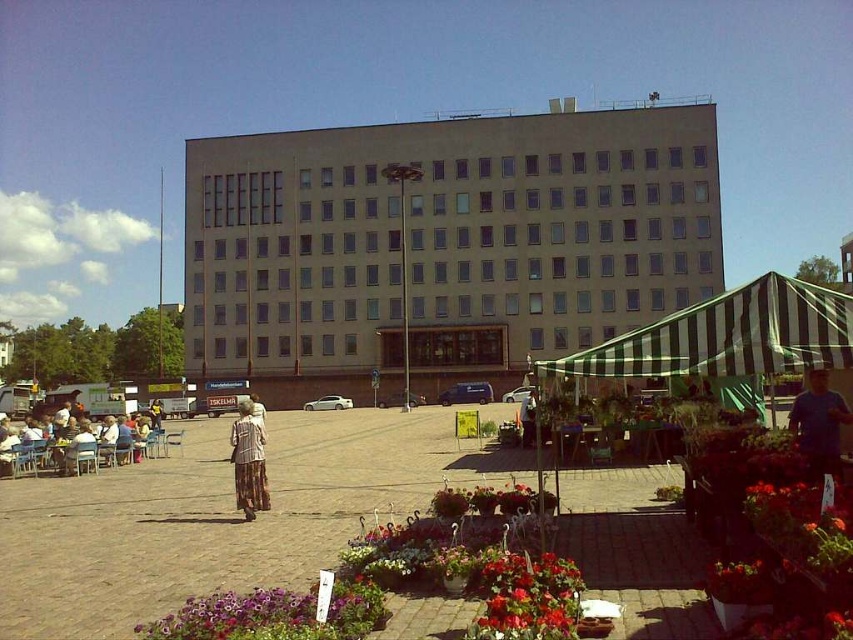
How much distance is there between purple matte flower at lower center and striped shirt at lower left?

purple matte flower at lower center is 14.54 meters away from striped shirt at lower left.

Is purple matte flower at lower center thinner than striped shirt at lower left?

Yes, purple matte flower at lower center is thinner than striped shirt at lower left.

Which is behind, point (134, 628) or point (128, 435)?

The point (128, 435) is more distant.

This screenshot has width=853, height=640. Identify the location of purple matte flower at lower center. (274, 614).

Consider the image. Is green striped canopy at right thinner than striped shirt at lower left?

In fact, green striped canopy at right might be wider than striped shirt at lower left.

Which is behind, point (796, 278) or point (91, 428)?

The point (796, 278) is more distant.

Who is more distant from viewer, (726,300) or (82,456)?

The point (82,456) is behind.

Where is `green striped canopy at right`? The height and width of the screenshot is (640, 853). green striped canopy at right is located at coordinates (728, 337).

Is striped shirt at lower left to the right of light brown textured pants at center from the viewer's perspective?

Incorrect, striped shirt at lower left is not on the right side of light brown textured pants at center.

Who is shorter, striped shirt at lower left or light brown textured pants at center?

With less height is light brown textured pants at center.

Who is more forward, (x=61, y=468) or (x=248, y=502)?

Point (x=248, y=502) is more forward.

Locate an element on the screen. The image size is (853, 640). striped shirt at lower left is located at coordinates point(102,442).